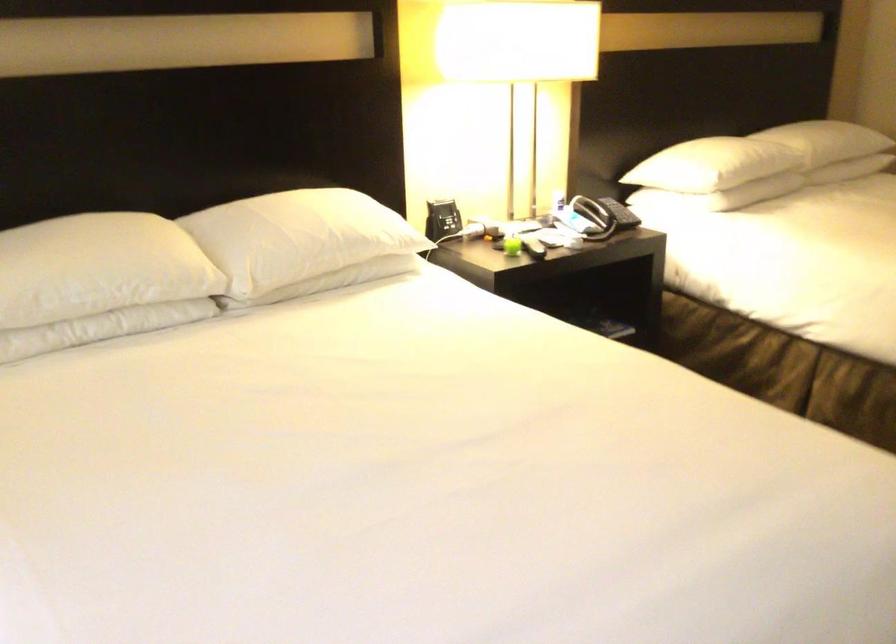
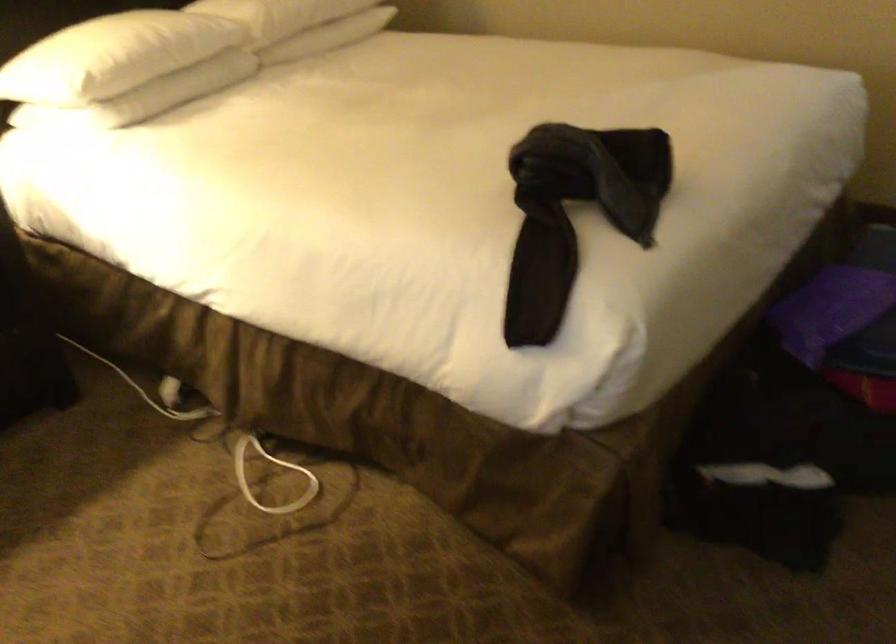
In a continuous first-person perspective shot, in which direction is the camera moving?

The cameraman moved toward right, forward.